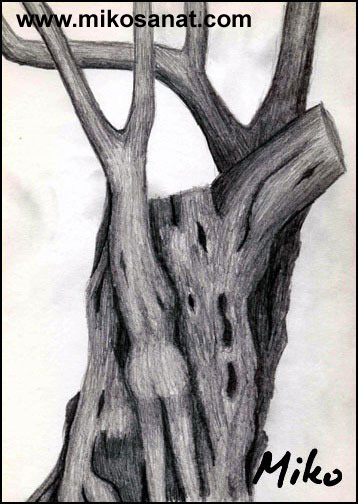
You are a GUI agent. You are given a task and a screenshot of the screen. Output one action in this format:
    pyautogui.click(x=<x>, y=<y>)
    Task: Click on the wood groove
    
    Given the screenshot: What is the action you would take?
    pyautogui.click(x=175, y=218)